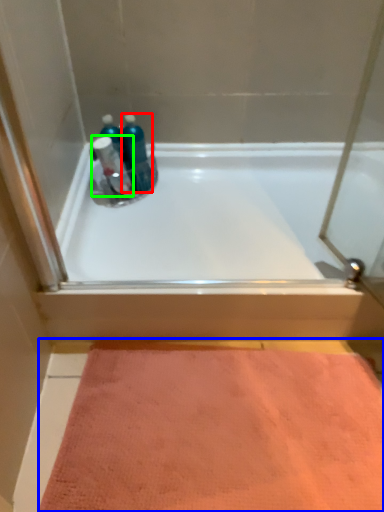
Question: Estimate the real-world distances between objects in this image. Which object is farther from mouthwash (highlighted by a red box), doormat (highlighted by a blue box) or cleaning product (highlighted by a green box)?

Choices:
 (A) doormat
 (B) cleaning product

Answer: (A)